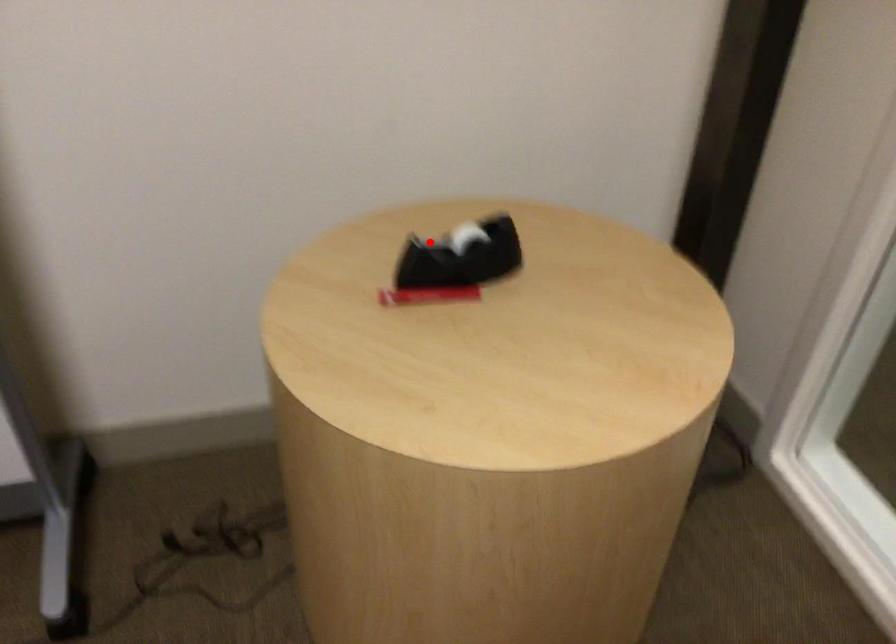
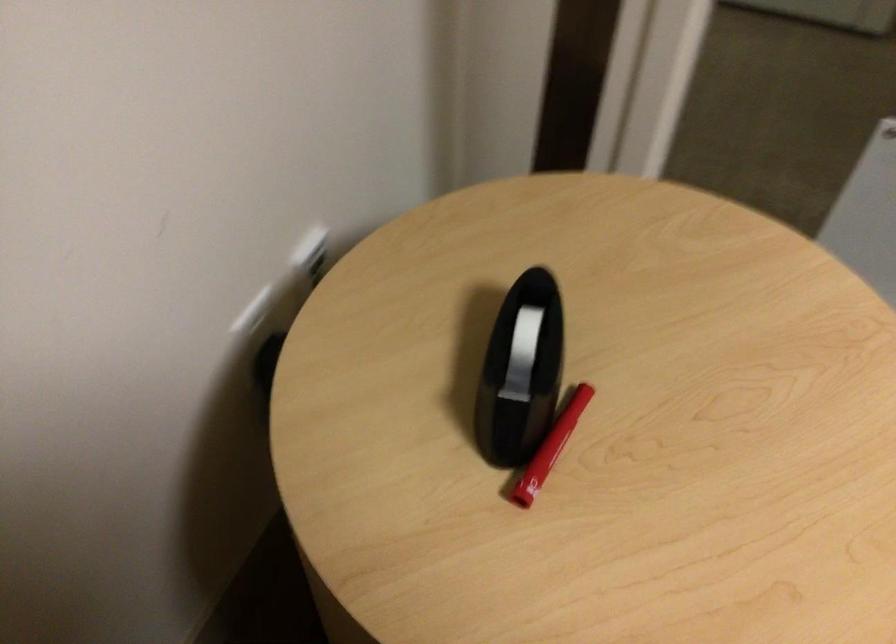
Question: I am providing you with two images of the same scene from different viewpoints. In image1, a red point is highlighted. Considering the same 3D point in image2, which of the following is correct?

Choices:
 (A) It is closer
 (B) It is farther

Answer: (A)